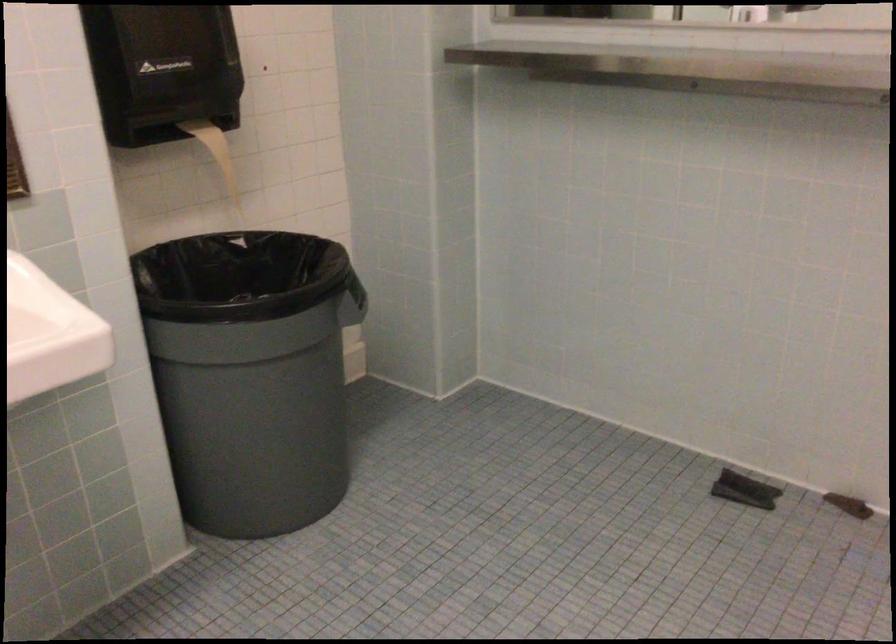
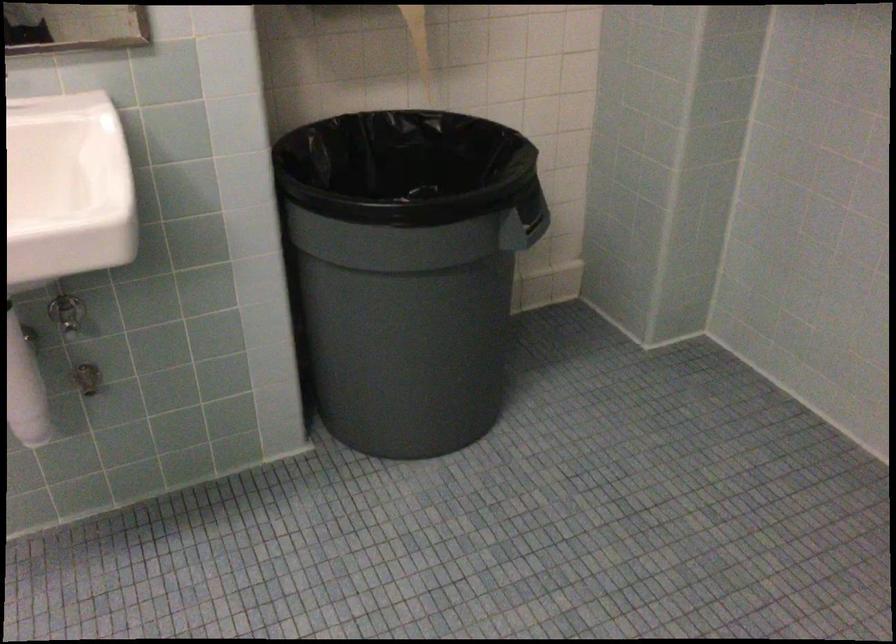
Find the pixel in the second image that matches point 197,377 in the first image.

(332, 272)